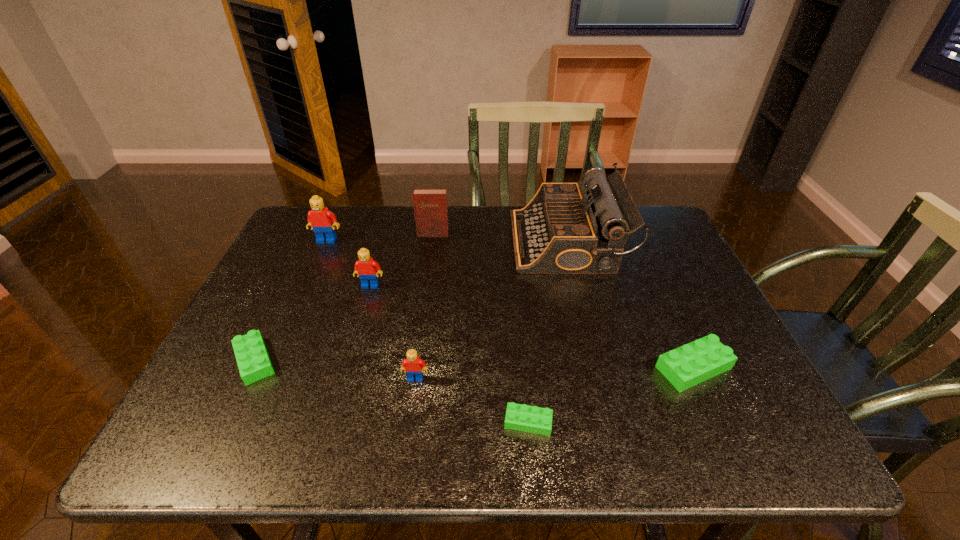
I want to click on blank space at the far edge, so click(x=351, y=234).

You are a GUI agent. You are given a task and a screenshot of the screen. Output one action in this format:
    pyautogui.click(x=<x>, y=<y>)
    Task: Click on the vacant space at the near edge of the desktop
    The width and height of the screenshot is (960, 540).
    Given the screenshot: What is the action you would take?
    pyautogui.click(x=357, y=429)

Image resolution: width=960 pixels, height=540 pixels. What are the coordinates of `free space at the left edge` in the screenshot? It's located at (300, 261).

Where is `free space at the right edge of the desktop`? This screenshot has height=540, width=960. free space at the right edge of the desktop is located at coordinates (660, 307).

Find the location of `vacant space at the far left corner of the desktop`. vacant space at the far left corner of the desktop is located at coordinates (282, 248).

At what (x,y) coordinates should I click in order to perform the action: click on vacant space at the far right corner of the desktop. Please return your answer as a coordinate pair (x, y). This screenshot has width=960, height=540. Looking at the image, I should click on (648, 239).

The height and width of the screenshot is (540, 960). In order to click on free space between the reddish-brown diary and the rightmost Lego in this screenshot , I will do `click(564, 301)`.

Locate an element on the screen. free space that is in between the reddish-brown diary and the smallest red Lego is located at coordinates (424, 306).

Image resolution: width=960 pixels, height=540 pixels. Identify the location of vacant region between the seventh tallest object and the farthest Lego. (291, 301).

Locate an element on the screen. free spot between the smallest green Lego and the leftmost green Lego is located at coordinates (392, 392).